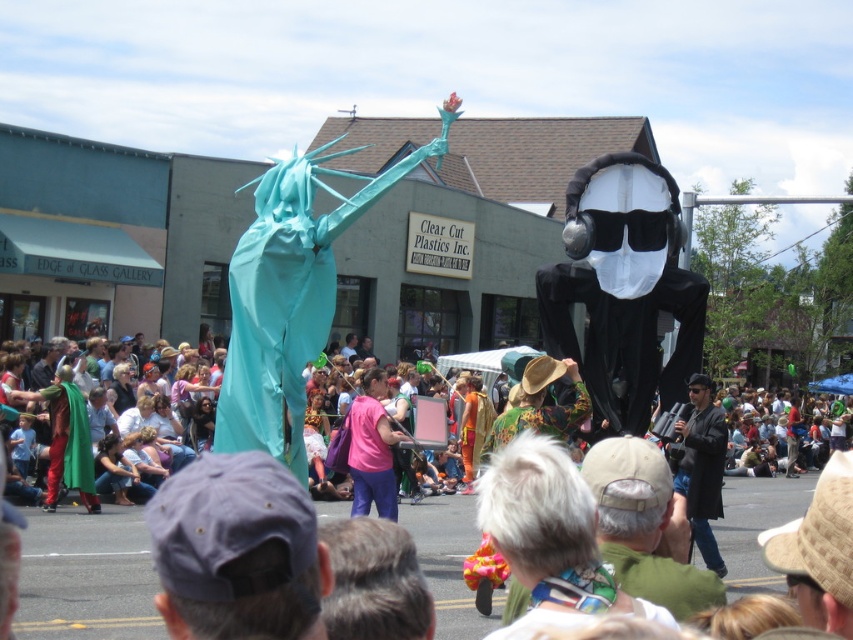
Who is taller, teal fabric statue at center or pink fabric shirt at center?

teal fabric statue at center

Describe the element at coordinates (289, 296) in the screenshot. I see `teal fabric statue at center` at that location.

The height and width of the screenshot is (640, 853). I want to click on teal fabric statue at center, so click(289, 296).

Consider the image. Is black matte ghost at center positioned before black leather jacket at center?

No, it is behind black leather jacket at center.

Is black matte ghost at center smaller than black leather jacket at center?

Incorrect, black matte ghost at center is not smaller in size than black leather jacket at center.

You are a GUI agent. You are given a task and a screenshot of the screen. Output one action in this format:
    pyautogui.click(x=<x>, y=<y>)
    Task: Click on the black matte ghost at center
    
    Given the screenshot: What is the action you would take?
    pyautogui.click(x=624, y=289)

Image resolution: width=853 pixels, height=640 pixels. I want to click on black matte ghost at center, so click(624, 289).

Who is more forward, (228, 264) or (221, 547)?

Answer: Point (221, 547)

From the picture: Can you confirm if teal fabric statue at center is thinner than dark blue fabric cap at center?

In fact, teal fabric statue at center might be wider than dark blue fabric cap at center.

Where is `teal fabric statue at center`? teal fabric statue at center is located at coordinates (289, 296).